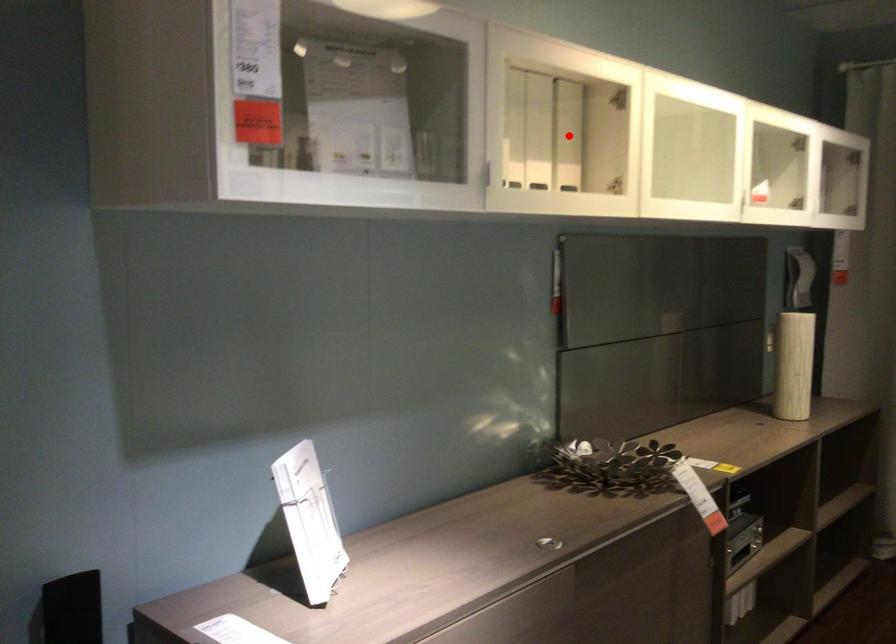
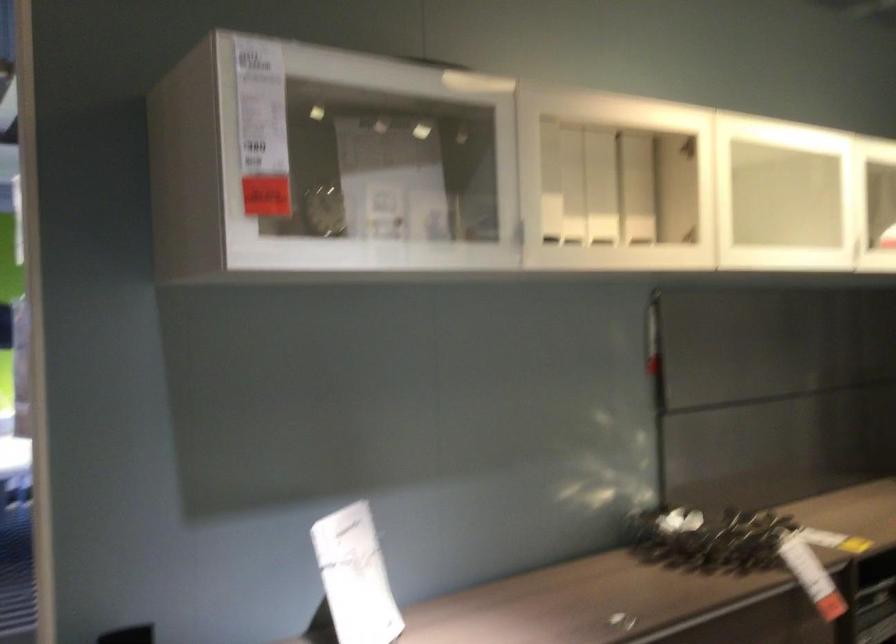
Where in the second image is the point corresponding to the highlighted location from the first image?

(636, 187)